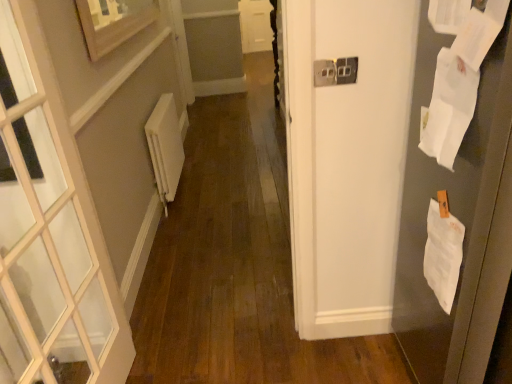
What do you see at coordinates (479, 34) in the screenshot? I see `white paper at upper right, arranged as the third paper when ordered from the bottom` at bounding box center [479, 34].

Locate an element on the screen. Image resolution: width=512 pixels, height=384 pixels. white paper at right, positioned as the 2th paper in bottom-to-top order is located at coordinates (448, 109).

Locate an element on the screen. The width and height of the screenshot is (512, 384). white paper at right, acting as the 3th paper starting from the top is located at coordinates (443, 254).

Find the location of a particular element. The image size is (512, 384). white paper at right is located at coordinates (458, 218).

Where is `white paper at upper right, arranged as the third paper when ordered from the bottom`? Image resolution: width=512 pixels, height=384 pixels. white paper at upper right, arranged as the third paper when ordered from the bottom is located at coordinates (479, 34).

Is white plastic electric outlet at upper center smaller than wooden picture frame at upper left?

Yes, white plastic electric outlet at upper center is smaller than wooden picture frame at upper left.

Is white plastic electric outlet at upper center turned away from wooden picture frame at upper left?

That's not correct — white plastic electric outlet at upper center is not looking away from wooden picture frame at upper left.

From a real-world perspective, is white plastic electric outlet at upper center physically above wooden picture frame at upper left?

No, from a real-world perspective, white plastic electric outlet at upper center is not on top of wooden picture frame at upper left.

Do you think white plastic electric outlet at upper center is within wooden picture frame at upper left, or outside of it?

white plastic electric outlet at upper center is not inside wooden picture frame at upper left, it's outside.

Can you tell me how much white paper at upper right, which is the 1th paper in top-to-bottom order, and white paper at right, the 1th paper in the bottom-to-top sequence, differ in facing direction?

white paper at upper right, which is the 1th paper in top-to-bottom order, and white paper at right, the 1th paper in the bottom-to-top sequence, are facing 5.45 degrees away from each other.

From the image's perspective, is white paper at upper right, arranged as the third paper when ordered from the bottom, above or below white paper at right, the 1th paper in the bottom-to-top sequence?

Based on their image positions, white paper at upper right, arranged as the third paper when ordered from the bottom, is located above white paper at right, the 1th paper in the bottom-to-top sequence.

Is white paper at upper right, which is the 1th paper in top-to-bottom order, thinner than white paper at right, the 1th paper in the bottom-to-top sequence?

In fact, white paper at upper right, which is the 1th paper in top-to-bottom order, might be wider than white paper at right, the 1th paper in the bottom-to-top sequence.

Consider the image. Is white paper at upper right, which is the 1th paper in top-to-bottom order, to the left of white paper at right, the 1th paper in the bottom-to-top sequence, from the viewer's perspective?

Yes.

Which is less distant, (x=343, y=68) or (x=505, y=8)?

Point (x=343, y=68) is positioned farther from the camera compared to point (x=505, y=8).

From a real-world perspective, which object stands above the other?

white paper at upper right, which is the 1th paper in top-to-bottom order, from a real-world perspective.

Is white plastic electric outlet at upper center facing away from white paper at upper right, arranged as the third paper when ordered from the bottom?

No, white plastic electric outlet at upper center is not facing the opposite direction of white paper at upper right, arranged as the third paper when ordered from the bottom.

Is white plastic electric outlet at upper center with white paper at upper right, which is the 1th paper in top-to-bottom order?

No.

Are white paper at right, which is the 2th paper in top-to-bottom order, and wooden picture frame at upper left making contact?

No, white paper at right, which is the 2th paper in top-to-bottom order, is not making contact with wooden picture frame at upper left.

How different are the orientations of white paper at right, which is the 2th paper in top-to-bottom order, and wooden picture frame at upper left in degrees?

They differ by 180 degrees in their facing directions.

Which of these two, white paper at right, positioned as the 2th paper in bottom-to-top order, or wooden picture frame at upper left, is wider?

white paper at right, positioned as the 2th paper in bottom-to-top order, is wider.

I want to click on picture frame that is behind the white paper at right, which is the 2th paper in top-to-bottom order, so click(x=113, y=22).

What's the angular difference between white paper at upper right, which is the 1th paper in top-to-bottom order, and white paper at right, positioned as the 2th paper in bottom-to-top order,'s facing directions?

3.93 degrees.

From the image's perspective, relative to white paper at right, which is the 2th paper in top-to-bottom order, is white paper at upper right, arranged as the third paper when ordered from the bottom, above or below?

Clearly, from the image's perspective, white paper at upper right, arranged as the third paper when ordered from the bottom, is above white paper at right, which is the 2th paper in top-to-bottom order.

Between white paper at upper right, which is the 1th paper in top-to-bottom order, and white paper at right, positioned as the 2th paper in bottom-to-top order, which one has more height?

With more height is white paper at right, positioned as the 2th paper in bottom-to-top order.

Is white paper at upper right, which is the 1th paper in top-to-bottom order, touching white paper at right, positioned as the 2th paper in bottom-to-top order?

They are not placed beside each other.

Considering the positions of objects white paper at right and wooden picture frame at upper left in the image provided, who is behind, white paper at right or wooden picture frame at upper left?

wooden picture frame at upper left is further away from the camera.

Can you tell me how much white paper at right and wooden picture frame at upper left differ in facing direction?

They differ by 179 degrees in their facing directions.

From a real-world perspective, is white paper at right located higher than wooden picture frame at upper left?

No, from a real-world perspective, white paper at right is not over wooden picture frame at upper left

Consider the image. Is white paper at right surrounded by white matte radiator at left?

No, white paper at right is located outside of white matte radiator at left.

Between white matte radiator at left and white paper at right, which one appears on the right side from the viewer's perspective?

white paper at right.

From the image's perspective, between white matte radiator at left and white paper at right, who is located below?

white paper at right.

Locate an element on the screen. electric outlet beneath the wooden picture frame at upper left (from a real-world perspective) is located at coordinates (335, 71).

Starting from the white paper at upper right, which is the 1th paper in top-to-bottom order, which paper is the 2nd one to the right? Please provide its 2D coordinates.

[(443, 254)]

Estimate the real-world distances between objects in this image. Which object is closer to white paper at right, which is the 2th paper in top-to-bottom order, white paper at right, the 1th paper in the bottom-to-top sequence, or white matte radiator at left?

white paper at right, the 1th paper in the bottom-to-top sequence.

Looking at this image, looking at the image, which one is located further to white matte radiator at left, white paper at right or white paper at right, acting as the 3th paper starting from the top?

white paper at right, acting as the 3th paper starting from the top, is further to white matte radiator at left.

Estimate the real-world distances between objects in this image. Which object is closer to white matte radiator at left, white paper at right, the 1th paper in the bottom-to-top sequence, or white plastic electric outlet at upper center?

white plastic electric outlet at upper center is positioned closer to the anchor white matte radiator at left.

Based on their spatial positions, is white paper at right or white plastic electric outlet at upper center closer to white paper at upper right, arranged as the third paper when ordered from the bottom?

Based on the image, white paper at right appears to be nearer to white paper at upper right, arranged as the third paper when ordered from the bottom.

When comparing their distances from white paper at right, acting as the 3th paper starting from the top, does white paper at upper right, which is the 1th paper in top-to-bottom order, or white plastic electric outlet at upper center seem further?

white plastic electric outlet at upper center is positioned further to the anchor white paper at right, acting as the 3th paper starting from the top.

Considering their positions, is white paper at right, acting as the 3th paper starting from the top, positioned further to white paper at upper right, arranged as the third paper when ordered from the bottom, than white paper at right?

white paper at right, acting as the 3th paper starting from the top, is further to white paper at upper right, arranged as the third paper when ordered from the bottom.

Based on their spatial positions, is white plastic electric outlet at upper center or white paper at upper right, arranged as the third paper when ordered from the bottom, closer to white matte radiator at left?

white plastic electric outlet at upper center is positioned closer to the anchor white matte radiator at left.

Considering their positions, is wooden picture frame at upper left positioned closer to white plastic electric outlet at upper center than white paper at right, positioned as the 2th paper in bottom-to-top order?

The object closer to white plastic electric outlet at upper center is white paper at right, positioned as the 2th paper in bottom-to-top order.

Locate an element on the screen. The image size is (512, 384). paper between white paper at upper right, arranged as the third paper when ordered from the bottom, and white paper at right, the 1th paper in the bottom-to-top sequence, in the vertical direction is located at coordinates (448, 109).

Where is `paper situated between wooden picture frame at upper left and white paper at right, positioned as the 2th paper in bottom-to-top order, from left to right`? This screenshot has width=512, height=384. paper situated between wooden picture frame at upper left and white paper at right, positioned as the 2th paper in bottom-to-top order, from left to right is located at coordinates 479,34.

Find the location of a particular element. The image size is (512, 384). electric outlet between wooden picture frame at upper left and white paper at right, positioned as the 2th paper in bottom-to-top order is located at coordinates (335, 71).

I want to click on picture frame between white paper at right, the 1th paper in the bottom-to-top sequence, and white matte radiator at left from front to back, so click(113, 22).